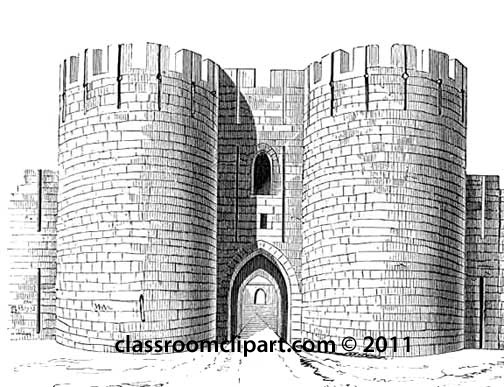
Where is `left wall`? left wall is located at coordinates (44, 259).